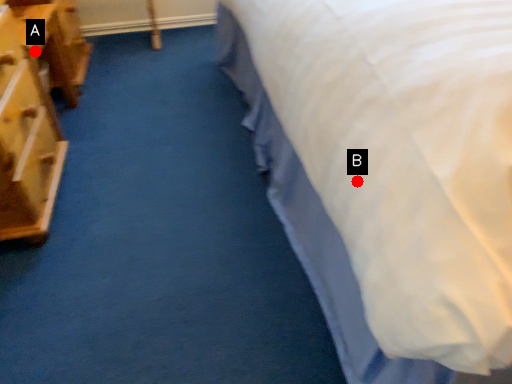
Question: Two points are circled on the image, labeled by A and B beside each circle. Which point is further to the camera?

Choices:
 (A) A is further
 (B) B is further

Answer: (A)